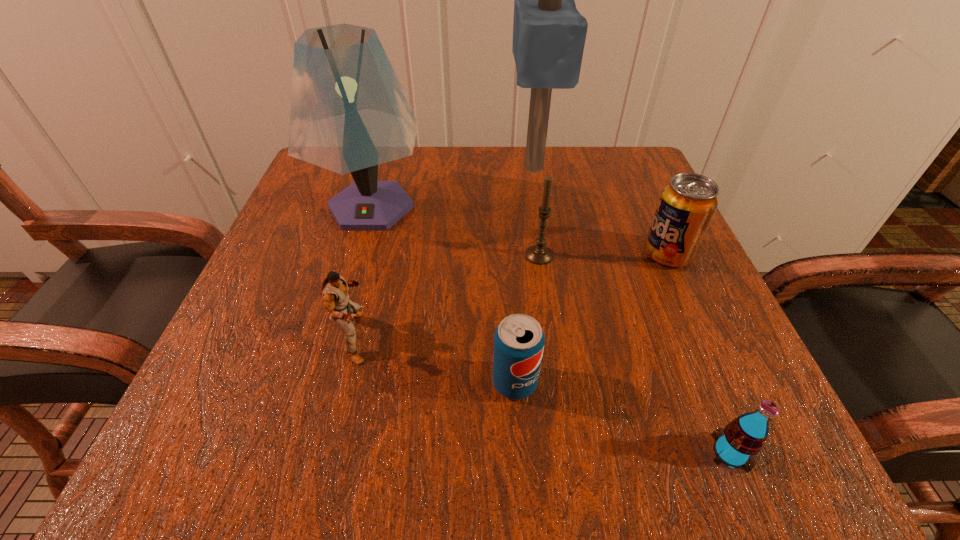
This screenshot has width=960, height=540. What are the coordinates of `mallet` in the screenshot? It's located at 549,33.

The width and height of the screenshot is (960, 540). Find the location of `lampshade`. lampshade is located at coordinates (349, 113).

Where is `candle`? The image size is (960, 540). candle is located at coordinates (539, 254).

Where is `the tallest soda`? This screenshot has width=960, height=540. the tallest soda is located at coordinates (687, 204).

Locate an element on the screen. The height and width of the screenshot is (540, 960). puncher is located at coordinates (334, 291).

I want to click on the second nearest soda, so click(x=519, y=340).

What are the coordinates of `the nearest object` in the screenshot? It's located at click(744, 437).

Where is `free spot located on the left of the mallet`? This screenshot has height=540, width=960. free spot located on the left of the mallet is located at coordinates (474, 167).

Where is `free region located 0.270m on the base of the lampshade`? This screenshot has width=960, height=540. free region located 0.270m on the base of the lampshade is located at coordinates (324, 372).

Where is `vacant space situated 0.370m on the left of the candle`? Image resolution: width=960 pixels, height=540 pixels. vacant space situated 0.370m on the left of the candle is located at coordinates (321, 255).